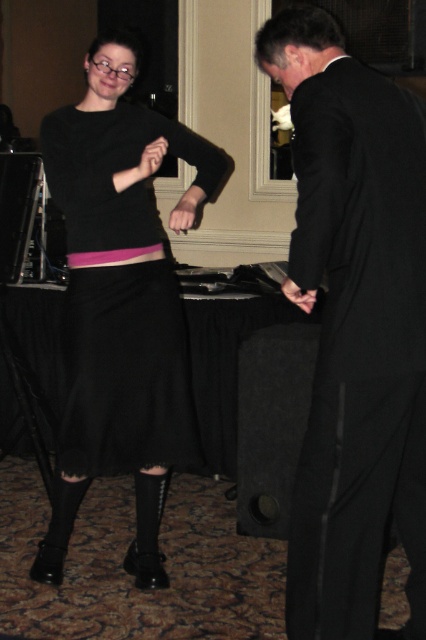
You are a photographer at the event and want to capture a photo where both the black matte suit at right and the pink fabric belt at center are clearly visible. Based on their positions, which object is closer to the camera?

The pink fabric belt at center is closer to the camera because the black matte suit at right is positioned under it, indicating it is behind and thus farther away.